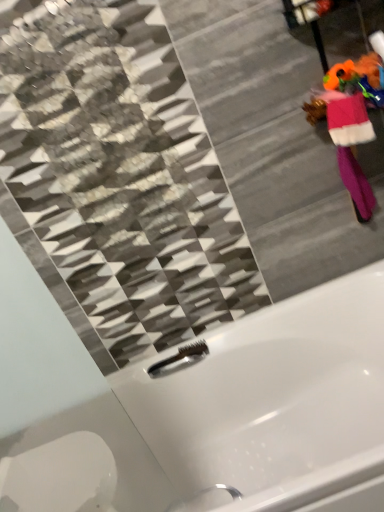
Question: Is white glossy bathtub at center positioned behind brushed metal faucet at lower center?

Choices:
 (A) yes
 (B) no

Answer: (B)

Question: Is white glossy bathtub at center oriented towards brushed metal faucet at lower center?

Choices:
 (A) yes
 (B) no

Answer: (B)

Question: Can you confirm if white glossy bathtub at center is positioned to the left of brushed metal faucet at lower center?

Choices:
 (A) yes
 (B) no

Answer: (B)

Question: Is white glossy bathtub at center far from brushed metal faucet at lower center?

Choices:
 (A) no
 (B) yes

Answer: (A)

Question: Is white glossy bathtub at center turned away from brushed metal faucet at lower center?

Choices:
 (A) no
 (B) yes

Answer: (A)

Question: From a real-world perspective, is white glossy bathtub at center on brushed metal faucet at lower center?

Choices:
 (A) yes
 (B) no

Answer: (B)

Question: Could white glossy bathtub at center be considered to be inside brushed metal faucet at lower center?

Choices:
 (A) no
 (B) yes

Answer: (A)

Question: Does brushed metal faucet at lower center turn towards white glossy bathtub at center?

Choices:
 (A) yes
 (B) no

Answer: (A)

Question: From the image's perspective, is brushed metal faucet at lower center over white glossy bathtub at center?

Choices:
 (A) yes
 (B) no

Answer: (A)

Question: Considering the relative positions of brushed metal faucet at lower center and white glossy bathtub at center in the image provided, is brushed metal faucet at lower center to the left of white glossy bathtub at center from the viewer's perspective?

Choices:
 (A) yes
 (B) no

Answer: (A)

Question: From the image's perspective, is brushed metal faucet at lower center beneath white glossy bathtub at center?

Choices:
 (A) no
 (B) yes

Answer: (A)

Question: Can you confirm if brushed metal faucet at lower center is taller than white glossy bathtub at center?

Choices:
 (A) no
 (B) yes

Answer: (A)

Question: Is pink fuzzy robe at right wider than white glossy bathtub at center?

Choices:
 (A) yes
 (B) no

Answer: (B)